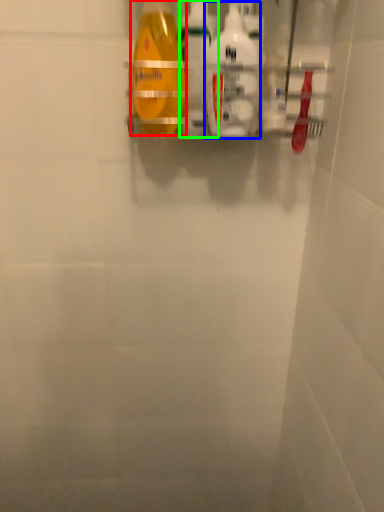
Question: Estimate the real-world distances between objects in this image. Which object is closer to bottle (highlighted by a red box), cleaning product (highlighted by a blue box) or cleaning product (highlighted by a green box)?

Choices:
 (A) cleaning product
 (B) cleaning product

Answer: (B)